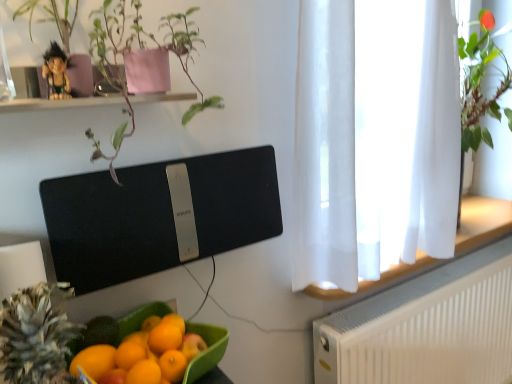
Question: Is green textured pineapple at lower left taller or shorter than plastic figurine at upper left?

Choices:
 (A) tall
 (B) short

Answer: (A)

Question: From the image's perspective, relative to plastic figurine at upper left, is green textured pineapple at lower left above or below?

Choices:
 (A) below
 (B) above

Answer: (A)

Question: Estimate the real-world distances between objects in this image. Which object is closer to the white textured radiator at lower right?

Choices:
 (A) white sheer curtain at right
 (B) green textured pineapple at lower left
 (C) plastic figurine at upper left
 (D) black matte speaker at upper center
 (E) green matte plant at upper left

Answer: (A)

Question: Estimate the real-world distances between objects in this image. Which object is farther from the black matte speaker at upper center?

Choices:
 (A) white sheer curtain at right
 (B) green textured pineapple at lower left
 (C) white textured radiator at lower right
 (D) green matte plant at upper left
 (E) plastic figurine at upper left

Answer: (C)